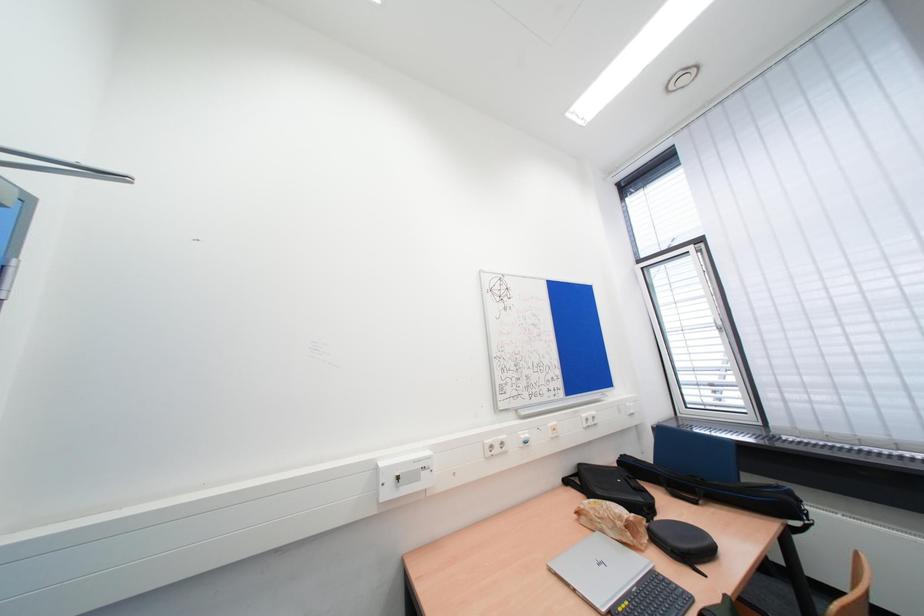
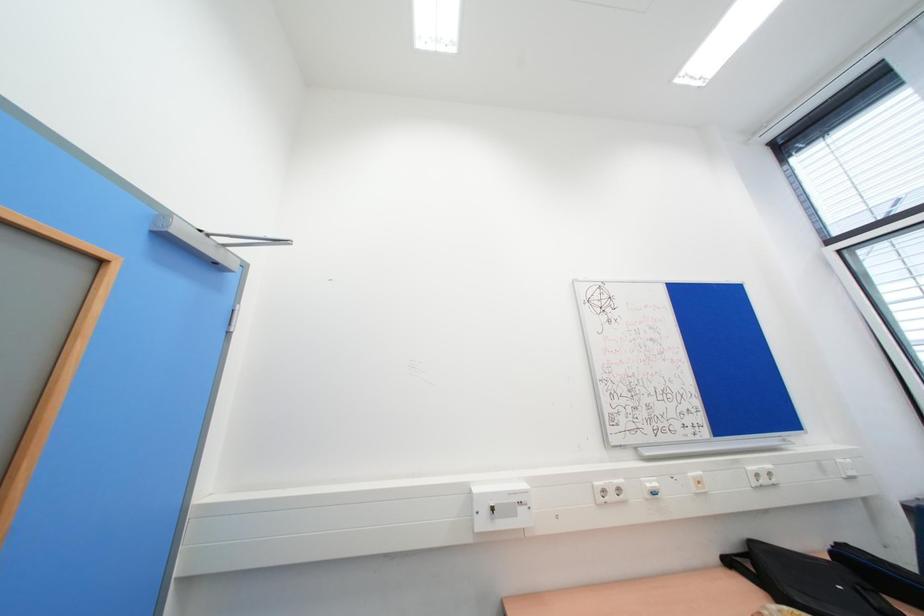
Question: What movement of the cameraman would produce the second image?

Choices:
 (A) Left
 (B) Right
 (C) Forward
 (D) Backward

Answer: (C)